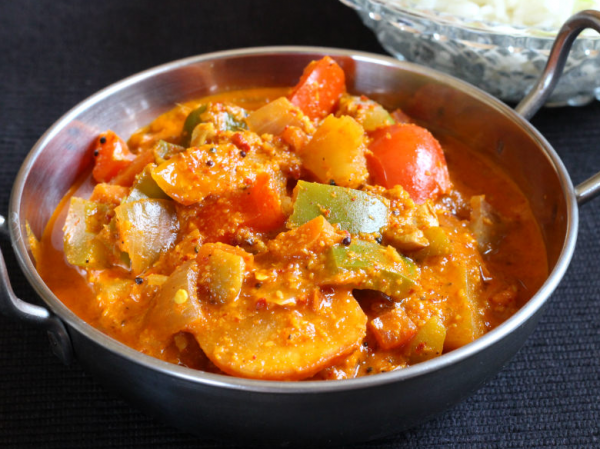
This screenshot has height=449, width=600. I want to click on metal pan, so click(488, 349).